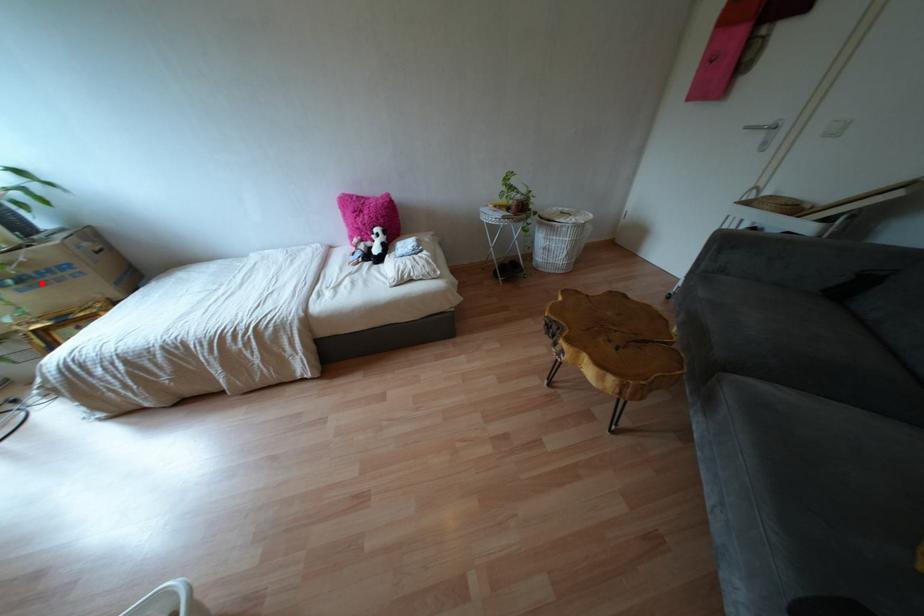
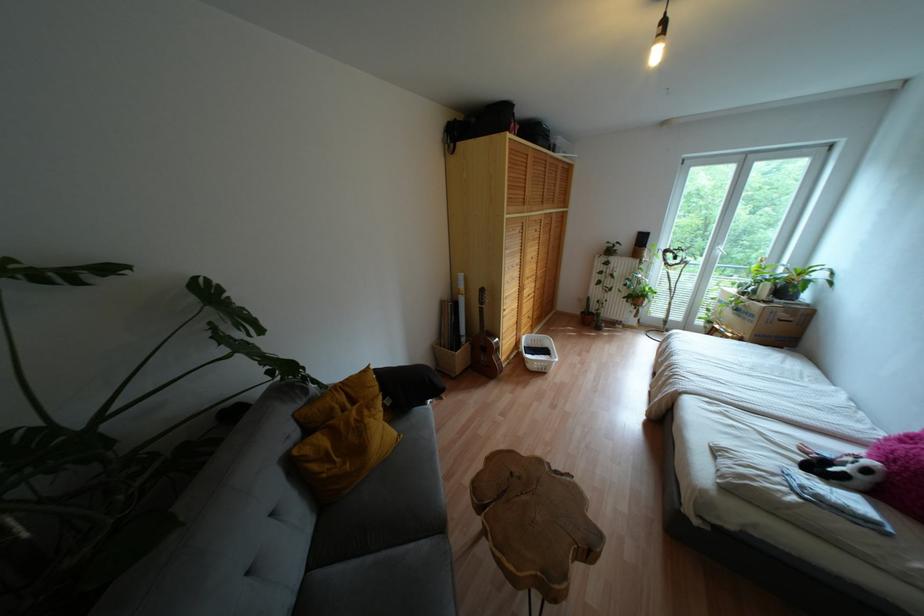
Question: I am providing you with two images of the same scene from different viewpoints. In image1, a red point is highlighted. Considering the same 3D point in image2, which of the following is correct?

Choices:
 (A) It is closer
 (B) It is farther

Answer: (A)